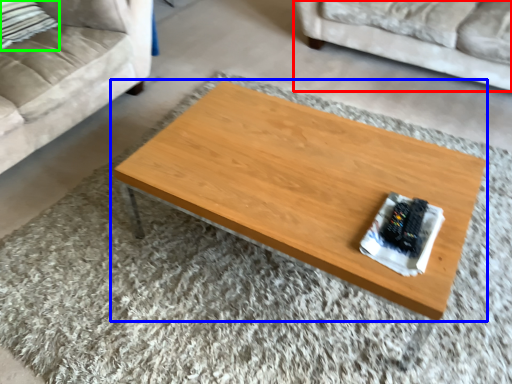
Question: Which object is the closest to the studio couch (highlighted by a red box)? Choose among these: coffee table (highlighted by a blue box) or pillow (highlighted by a green box).

Choices:
 (A) coffee table
 (B) pillow

Answer: (A)